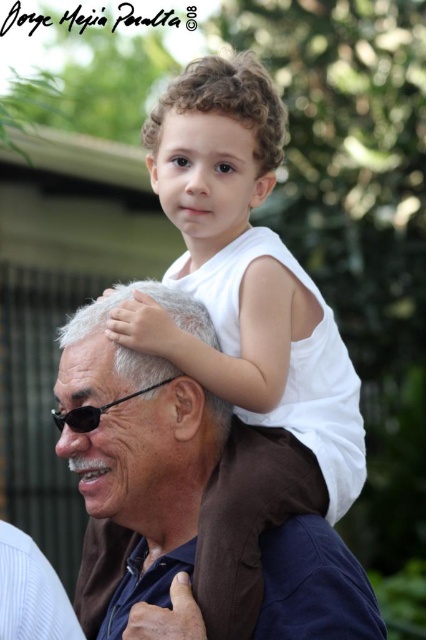
Based on the photo, you are a fashion designer observing the scene. You notice the brown fabric at center and the black plastic goggles at center. Which item is placed lower in the image?

The brown fabric at center is positioned under the black plastic goggles at center, so it is placed lower in the image.

You are a photographer trying to capture a candid shot of the brown fabric at center and the black plastic goggles at center. You want to ensure both subjects are in focus. Since the camera can only focus on one object at a time, which object should you prioritize focusing on to make sure the other is also in focus?

The brown fabric at center is taller than black plastic goggles at center. Therefore, focusing on the brown fabric at center would ensure the black plastic goggles at center is also in focus because it is closer to the camera.